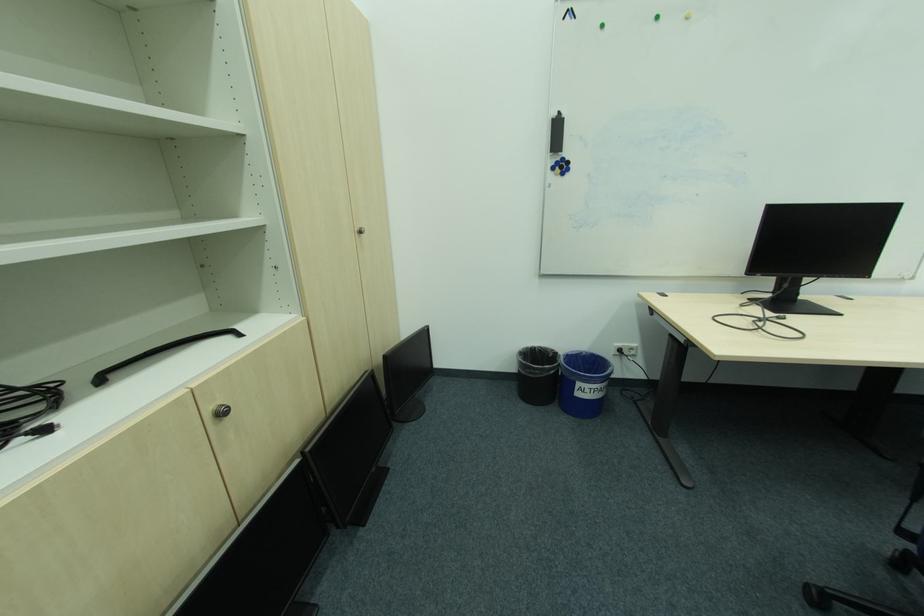
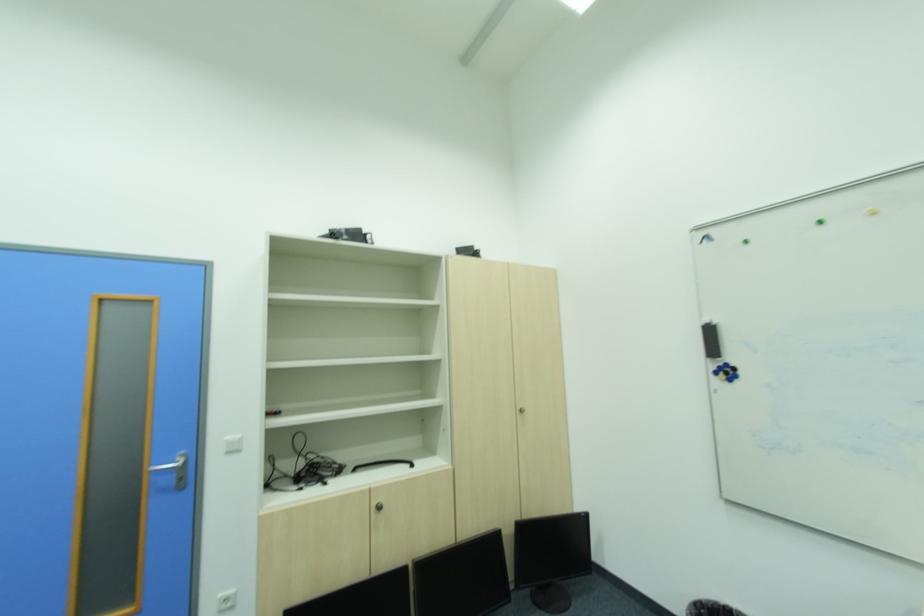
Where in the second image is the point corresponding to point 565,124 from the first image?

(716, 331)